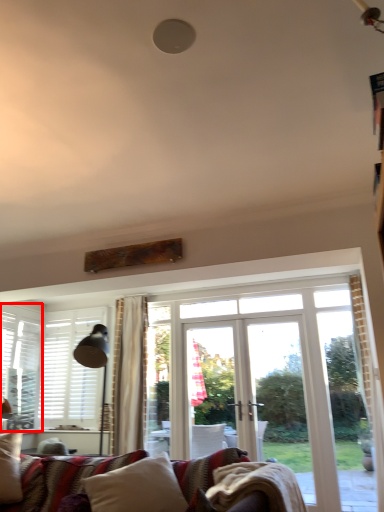
Question: From the image's perspective, what is the correct spatial relationship of window (annotated by the red box) in relation to pillow?

Choices:
 (A) above
 (B) below

Answer: (A)